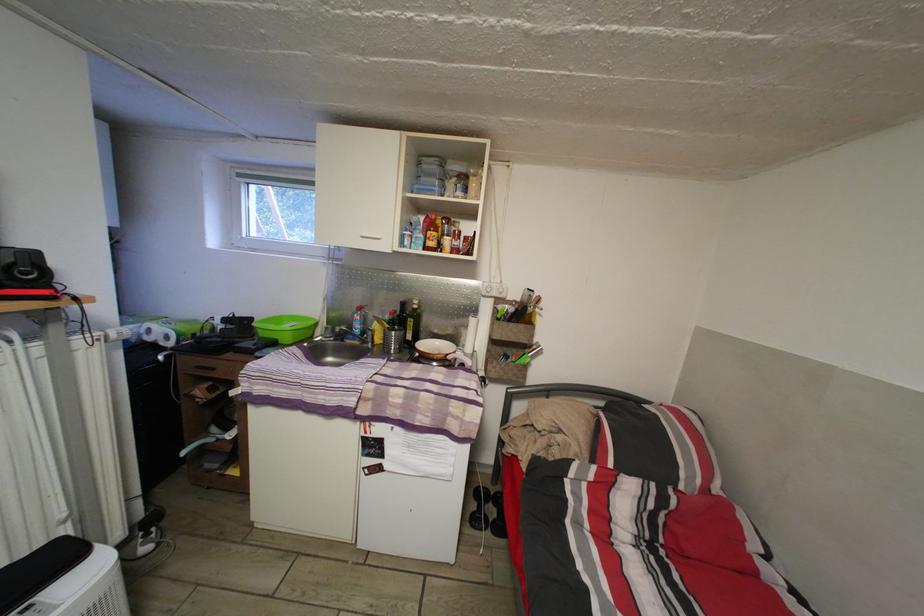
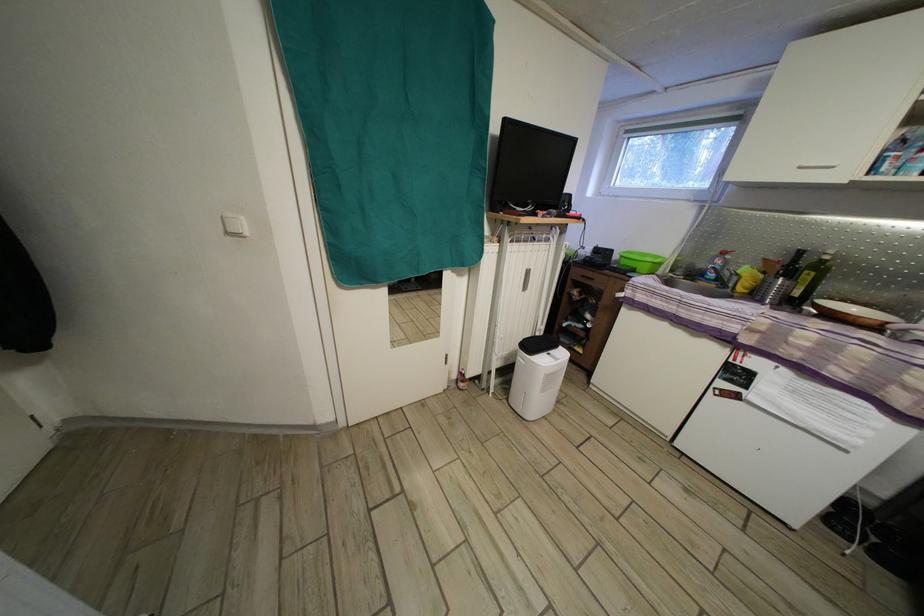
Question: The camera is either moving clockwise (left) or counter-clockwise (right) around the object. The first image is from the beginning of the video and the second image is from the end. Is the camera moving left or right when shooting the video?

Choices:
 (A) Left
 (B) Right

Answer: (B)